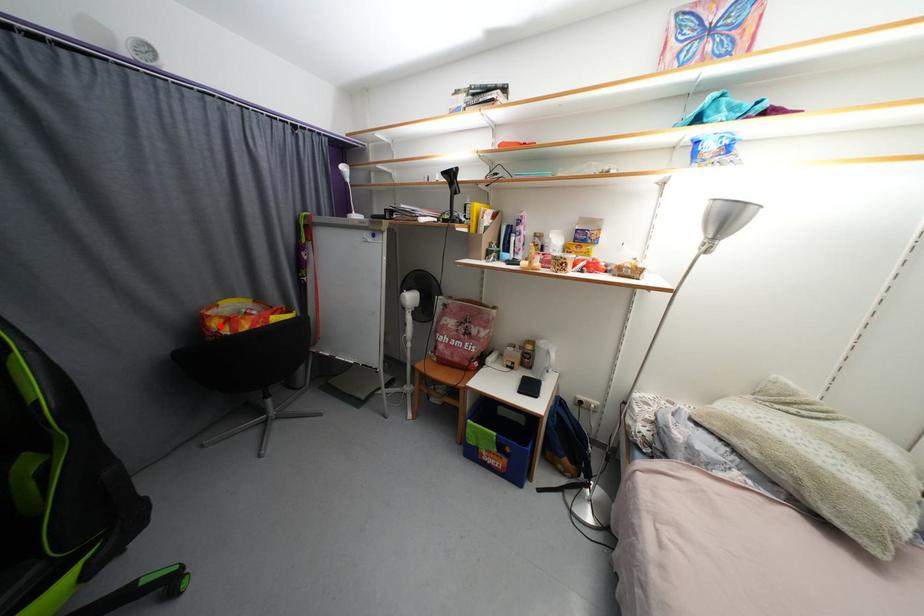
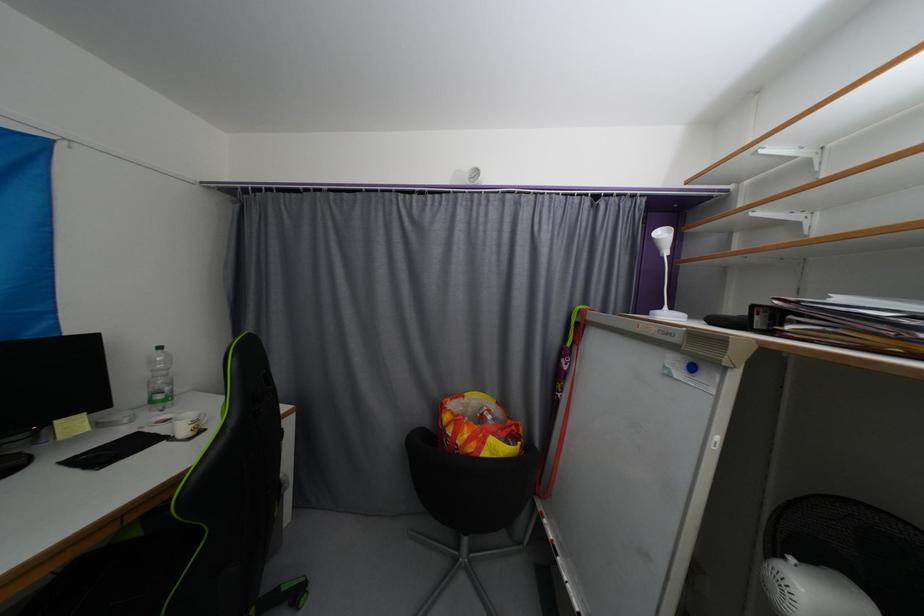
In the second image, find the point that corresponds to the highlighted location in the first image.

(452, 419)